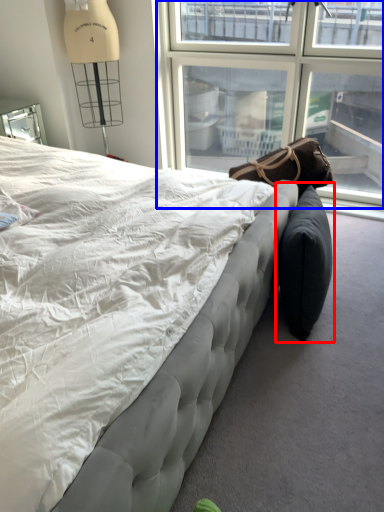
Question: Which object is closer to the camera taking this photo, bean bag chair (highlighted by a red box) or window (highlighted by a blue box)?

Choices:
 (A) bean bag chair
 (B) window

Answer: (A)